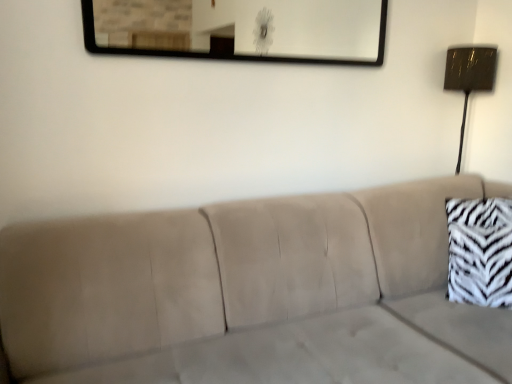
Question: Is metallic rectangular mirror at upper center wider than metallic gold lamp at right?

Choices:
 (A) no
 (B) yes

Answer: (A)

Question: Does metallic rectangular mirror at upper center have a lesser width compared to metallic gold lamp at right?

Choices:
 (A) no
 (B) yes

Answer: (B)

Question: Is metallic rectangular mirror at upper center smaller than metallic gold lamp at right?

Choices:
 (A) yes
 (B) no

Answer: (A)

Question: Can you confirm if metallic rectangular mirror at upper center is positioned to the left of metallic gold lamp at right?

Choices:
 (A) yes
 (B) no

Answer: (A)

Question: Is metallic rectangular mirror at upper center at the right side of metallic gold lamp at right?

Choices:
 (A) no
 (B) yes

Answer: (A)

Question: From a real-world perspective, is metallic rectangular mirror at upper center positioned above or below beige fabric couch at center?

Choices:
 (A) below
 (B) above

Answer: (B)

Question: Is metallic rectangular mirror at upper center spatially inside beige fabric couch at center, or outside of it?

Choices:
 (A) inside
 (B) outside

Answer: (B)

Question: Is metallic rectangular mirror at upper center in front of or behind beige fabric couch at center in the image?

Choices:
 (A) behind
 (B) front

Answer: (A)

Question: Considering the positions of point (182, 23) and point (392, 276), is point (182, 23) closer or farther from the camera than point (392, 276)?

Choices:
 (A) closer
 (B) farther

Answer: (B)

Question: Considering the positions of beige fabric couch at center and metallic rectangular mirror at upper center in the image, is beige fabric couch at center taller or shorter than metallic rectangular mirror at upper center?

Choices:
 (A) short
 (B) tall

Answer: (B)

Question: Relative to metallic rectangular mirror at upper center, is beige fabric couch at center in front or behind?

Choices:
 (A) behind
 (B) front

Answer: (B)

Question: Would you say beige fabric couch at center is to the left or to the right of metallic rectangular mirror at upper center in the picture?

Choices:
 (A) right
 (B) left

Answer: (B)

Question: From the image's perspective, is beige fabric couch at center above or below metallic rectangular mirror at upper center?

Choices:
 (A) below
 (B) above

Answer: (A)

Question: Looking at their shapes, would you say zebra print fabric pillow at right is wider or thinner than metallic rectangular mirror at upper center?

Choices:
 (A) thin
 (B) wide

Answer: (B)

Question: From their relative heights in the image, would you say zebra print fabric pillow at right is taller or shorter than metallic rectangular mirror at upper center?

Choices:
 (A) tall
 (B) short

Answer: (A)